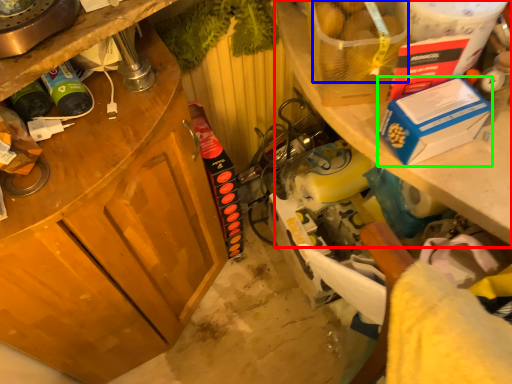
Question: Estimate the real-world distances between objects in this image. Which object is closer to shelf (highlighted by a red box), food (highlighted by a blue box) or box (highlighted by a green box)?

Choices:
 (A) food
 (B) box

Answer: (B)